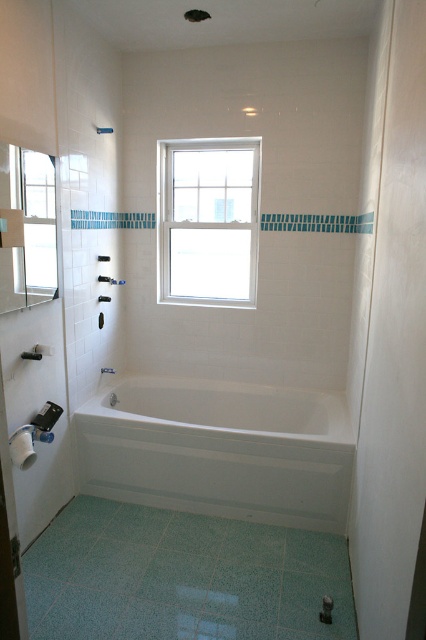
You are standing at the entrance of the bathroom and want to reach the white glossy bathtub at center. The bathroom has a 10 feet long path from the entrance to the bathtub. Is there enough space to walk directly to the bathtub?

The distance between you and the white glossy bathtub at center is 8.56 feet, which is less than the 10 feet path available, so yes, there is enough space to walk directly to the bathtub.

You are standing in the bathroom and want to place a new floor mat. Where should you place it to avoid covering the white glossy bathtub at center?

The white glossy bathtub at center is located at point (218, 451), so place the floor mat away from that position to avoid covering it.